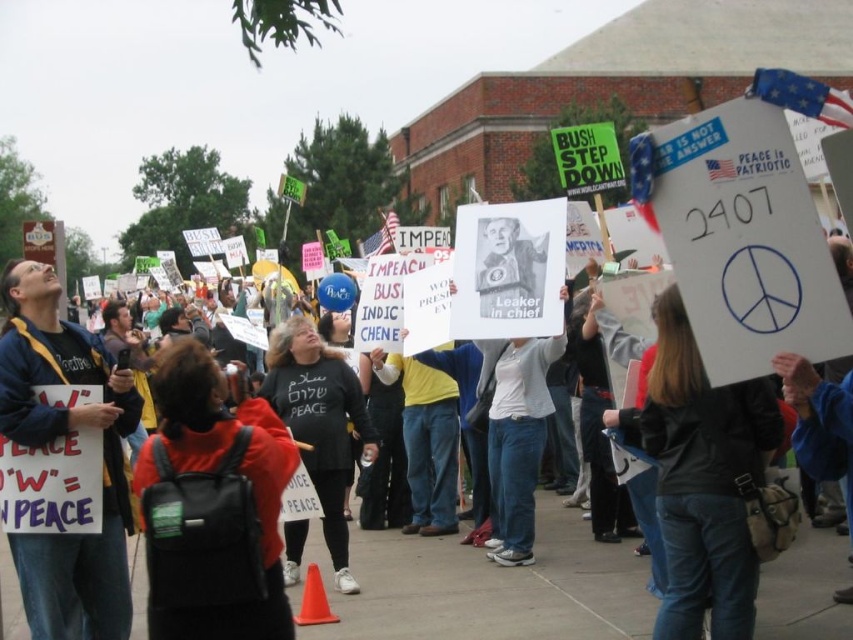
Between black backpack at center and black cotton shirt at center, which one appears on the right side from the viewer's perspective?

black cotton shirt at center is more to the right.

This screenshot has height=640, width=853. Identify the location of black backpack at center. (212, 472).

This screenshot has height=640, width=853. What are the coordinates of `black backpack at center` in the screenshot? It's located at pyautogui.click(x=212, y=472).

From the picture: Does blue denim jacket at left have a larger size compared to black cotton shirt at center?

Yes.

Based on the photo, between blue denim jacket at left and black cotton shirt at center, which one has more height?

Standing taller between the two is blue denim jacket at left.

Is point (99, 360) farther from camera compared to point (296, 525)?

No.

Find the location of a particular element. The width and height of the screenshot is (853, 640). blue denim jacket at left is located at coordinates (54, 438).

Is black fabric jacket at center smaller than black leather jacket at center?

Actually, black fabric jacket at center might be larger than black leather jacket at center.

Which is more to the right, black fabric jacket at center or black leather jacket at center?

black leather jacket at center

This screenshot has width=853, height=640. Identify the location of black fabric jacket at center. (488, 588).